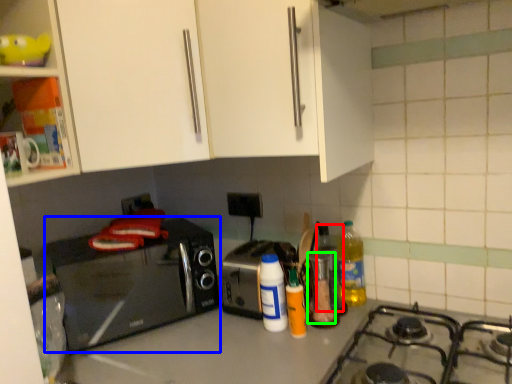
Question: Which object is the closest to the bottle (highlighted by a red box)? Choose among these: home appliance (highlighted by a blue box) or appliance (highlighted by a green box).

Choices:
 (A) home appliance
 (B) appliance

Answer: (B)